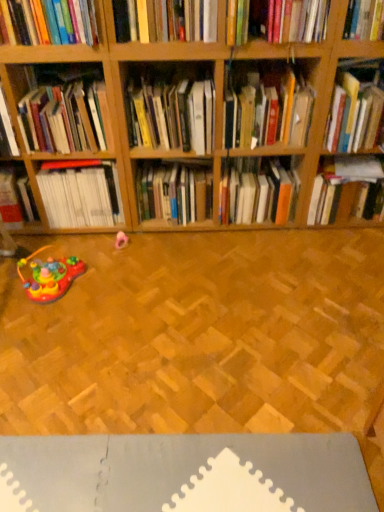
Locate an element on the screen. vacant space that's between rubberized plastic toy at lower left, positioned as the 2th toy in back-to-front order, and pink rubber duck at center, which is the first toy in top-to-bottom order is located at coordinates (102, 263).